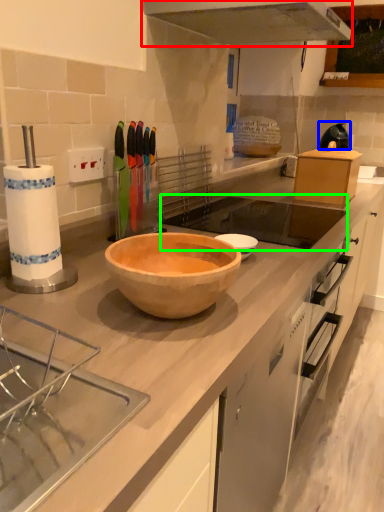
Question: Based on their relative distances, which object is farther from exhaust hood (highlighted by a red box)? Choose from appliance (highlighted by a blue box) and sink (highlighted by a green box).

Choices:
 (A) appliance
 (B) sink

Answer: (A)